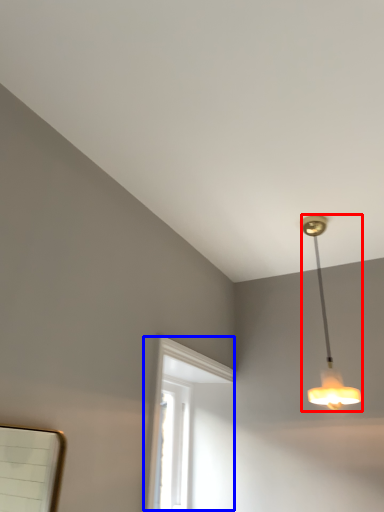
Question: Which of the following is the closest to the observer, lamp (highlighted by a red box) or window (highlighted by a blue box)?

Choices:
 (A) lamp
 (B) window

Answer: (B)